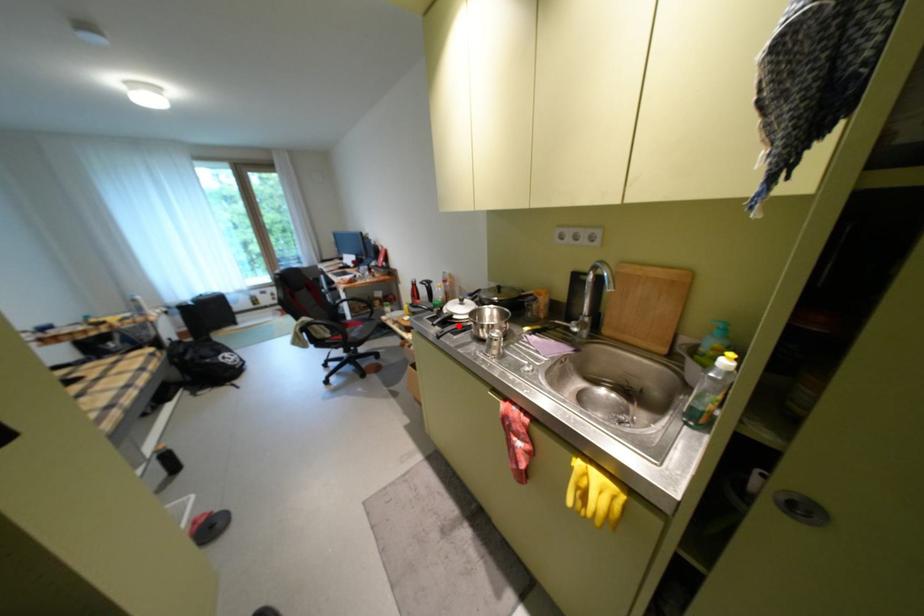
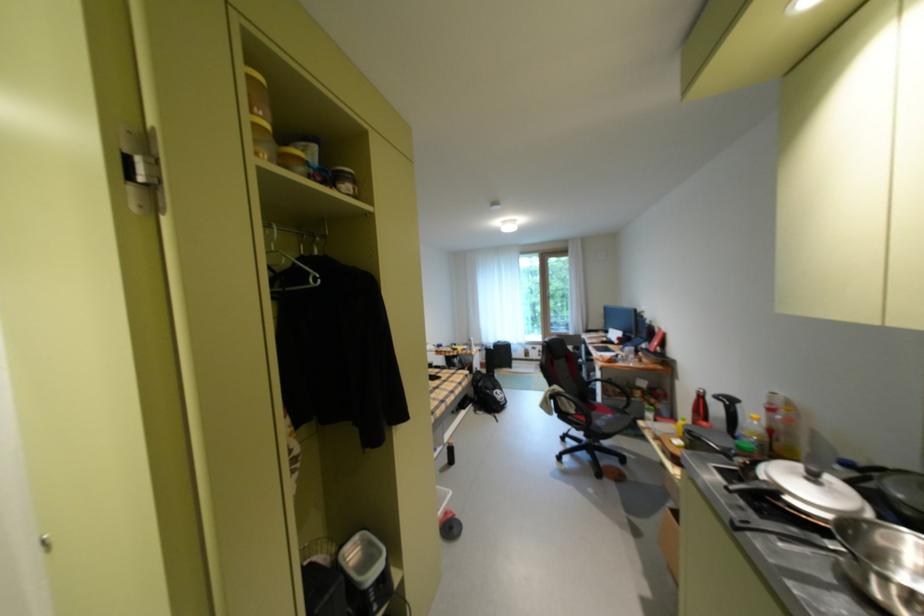
Question: I am providing you with two images of the same scene from different viewpoints. A red point is marked on the first image. Is the red point's position out of view in image 2?

Choices:
 (A) Yes
 (B) No

Answer: (B)